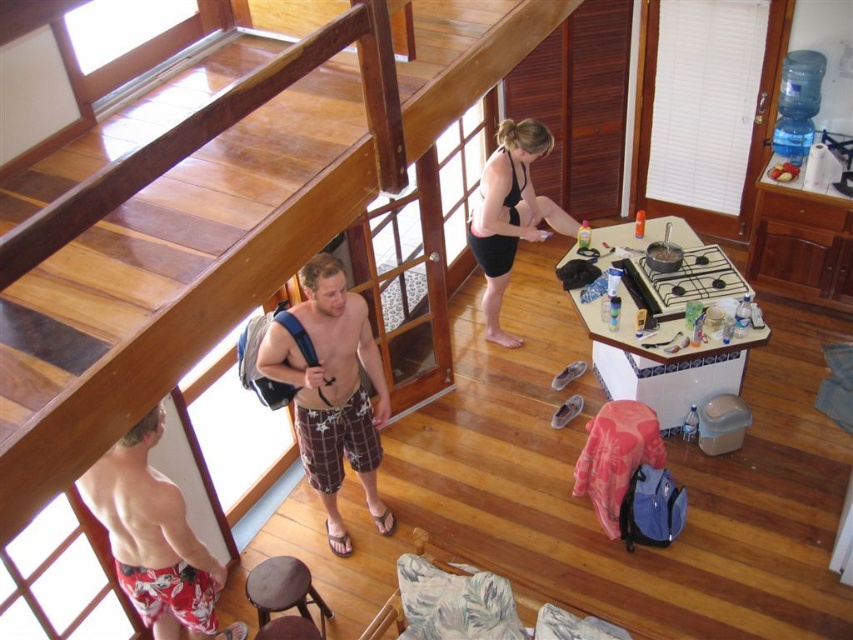
Question: Which object is positioned farthest from the printed cotton shorts at lower left?

Choices:
 (A) wooden at upper center
 (B) brown wooden stool at lower center

Answer: (A)

Question: Which object appears farthest from the camera in this image?

Choices:
 (A) wooden at upper center
 (B) plaid fabric shorts at center

Answer: (B)

Question: Among these points, which one is nearest to the camera?

Choices:
 (A) (515, 180)
 (B) (123, 451)

Answer: (B)

Question: Is printed cotton shorts at lower left to the left of black matte swimsuit at center from the viewer's perspective?

Choices:
 (A) yes
 (B) no

Answer: (A)

Question: Does wooden at upper center appear on the left side of brown wooden stool at lower center?

Choices:
 (A) yes
 (B) no

Answer: (B)

Question: Can you confirm if wooden at upper center is thinner than printed cotton shorts at lower left?

Choices:
 (A) yes
 (B) no

Answer: (B)